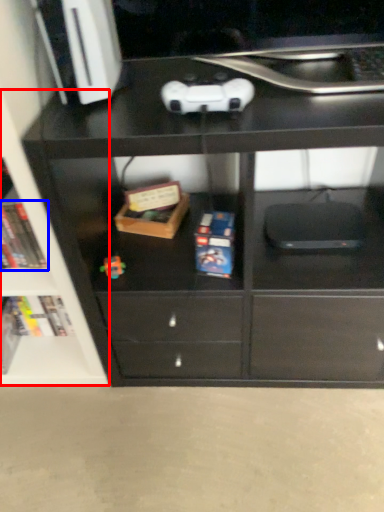
Question: Which object is closer to the camera taking this photo, shelf (highlighted by a red box) or book (highlighted by a blue box)?

Choices:
 (A) shelf
 (B) book

Answer: (A)